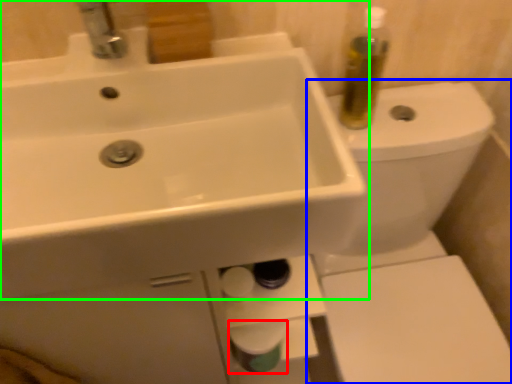
Question: Estimate the real-world distances between objects in this image. Which object is closer to toilet paper (highlighted by a red box), toilet (highlighted by a blue box) or sink (highlighted by a green box)?

Choices:
 (A) toilet
 (B) sink

Answer: (A)